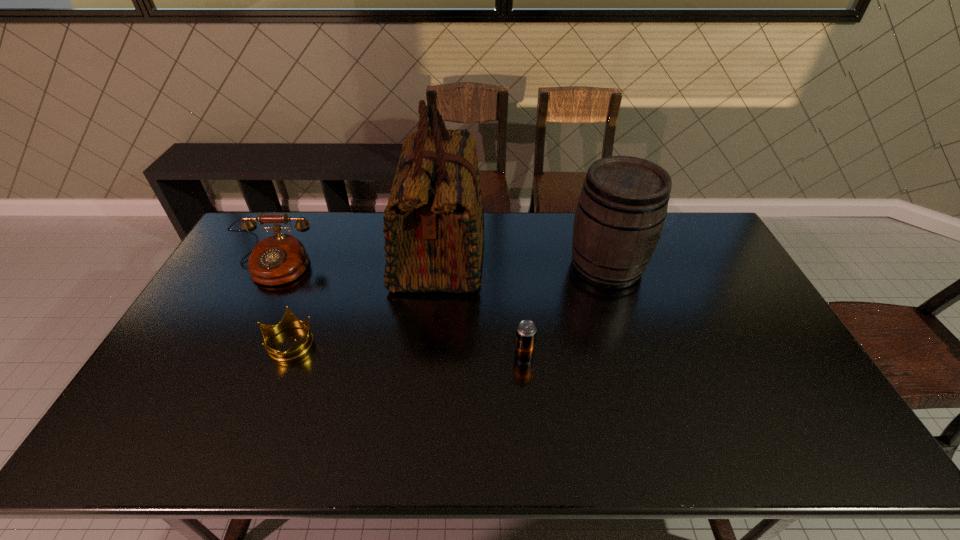
The height and width of the screenshot is (540, 960). I want to click on free point between the tallest object and the telephone, so click(357, 260).

The height and width of the screenshot is (540, 960). I want to click on unoccupied area between the telephone and the second object from right to left, so click(x=398, y=312).

Locate an element on the screen. The image size is (960, 540). vacant space in between the crown and the third shortest object is located at coordinates [281, 305].

Image resolution: width=960 pixels, height=540 pixels. Find the location of `object identified as the third closest to the second object from right to left`. object identified as the third closest to the second object from right to left is located at coordinates (289, 320).

You are a GUI agent. You are given a task and a screenshot of the screen. Output one action in this format:
    pyautogui.click(x=<x>, y=<y>)
    Task: Click on the fourth closest object to the third shortest object
    
    Given the screenshot: What is the action you would take?
    pyautogui.click(x=622, y=207)

The image size is (960, 540). I want to click on free space that satisfies the following two spatial constraints: 1. on the dial of the third shortest object; 2. on the left side of the crown, so click(235, 342).

Locate an element on the screen. Image resolution: width=960 pixels, height=540 pixels. vacant region that satisfies the following two spatial constraints: 1. on the open handle side of the third object from right to left; 2. on the front side of the crown is located at coordinates (431, 342).

Locate an element on the screen. free space that satisfies the following two spatial constraints: 1. on the front side of the beer can; 2. on the right side of the shortest object is located at coordinates (284, 356).

Locate an element on the screen. vacant region that satisfies the following two spatial constraints: 1. on the open handle side of the fourth object from left to right; 2. on the left side of the tallest object is located at coordinates (429, 356).

Where is `vacant space that satisfies the following two spatial constraints: 1. on the dial of the fourth tallest object; 2. on the left side of the telephone`? The image size is (960, 540). vacant space that satisfies the following two spatial constraints: 1. on the dial of the fourth tallest object; 2. on the left side of the telephone is located at coordinates (228, 356).